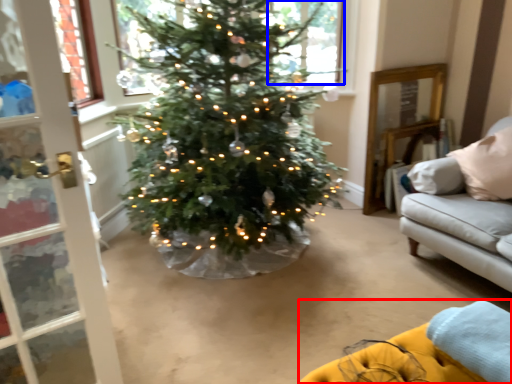
Question: Among these objects, which one is nearest to the camera, couch (highlighted by a red box) or window (highlighted by a blue box)?

Choices:
 (A) couch
 (B) window

Answer: (A)